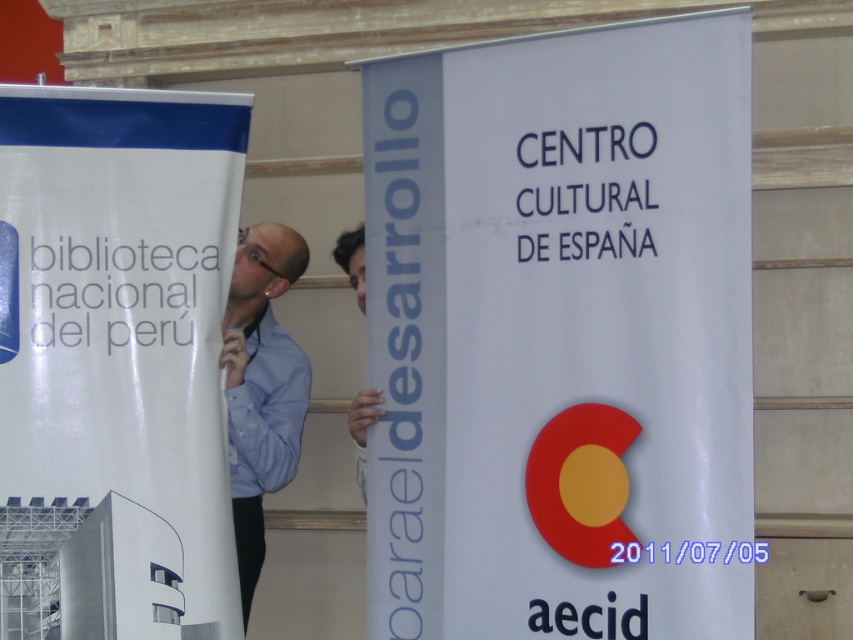
Question: Does white paper banner at center have a larger size compared to white paper banner at left?

Choices:
 (A) yes
 (B) no

Answer: (A)

Question: Which is farther from the matte blue shirt at center?

Choices:
 (A) white paper banner at center
 (B) white paper banner at left

Answer: (A)

Question: Is blue shirt at left closer to camera compared to matte blue shirt at center?

Choices:
 (A) yes
 (B) no

Answer: (A)

Question: Which of the following is the closest to the observer?

Choices:
 (A) white paper banner at left
 (B) white paper banner at center
 (C) blue shirt at left
 (D) light blue cotton shirt at left

Answer: (B)

Question: Does white paper banner at center appear on the right side of light blue cotton shirt at left?

Choices:
 (A) no
 (B) yes

Answer: (B)

Question: Among these points, which one is nearest to the camera?

Choices:
 (A) (294, 237)
 (B) (340, 260)

Answer: (A)